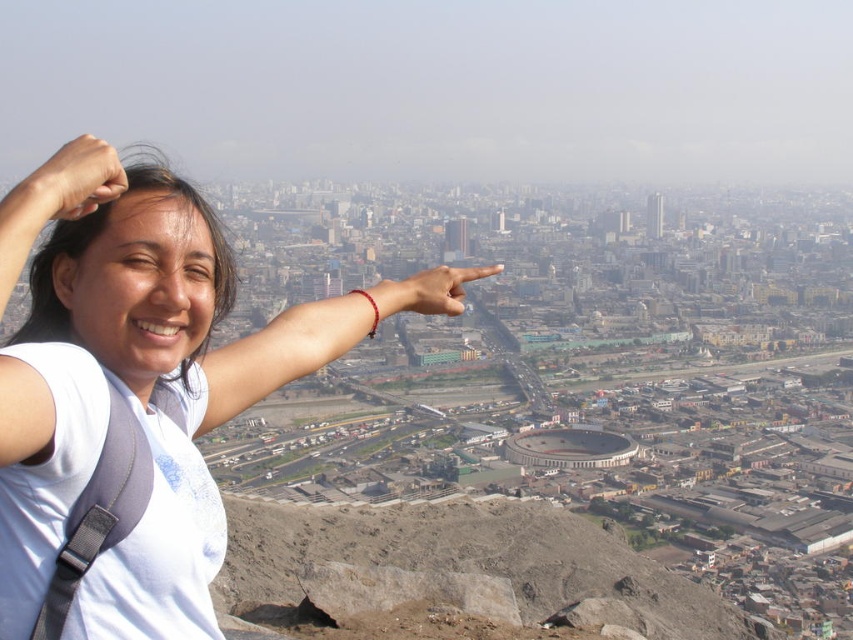
Question: Which point is closer to the camera?

Choices:
 (A) (49, 209)
 (B) (453, 301)
 (C) (163, 205)

Answer: (A)

Question: Can you confirm if matte skin hand at upper left is bigger than matte skin hand at center?

Choices:
 (A) no
 (B) yes

Answer: (B)

Question: Can you confirm if dull gray rock at center is smaller than matte skin hand at upper left?

Choices:
 (A) yes
 (B) no

Answer: (B)

Question: Which object appears farthest from the camera in this image?

Choices:
 (A) matte skin hand at center
 (B) dull gray rock at center
 (C) white matte shirt at upper left

Answer: (B)

Question: Which of the following is the closest to the observer?

Choices:
 (A) white matte shirt at upper left
 (B) matte skin hand at center
 (C) matte skin hand at upper left

Answer: (A)

Question: Is matte skin hand at upper left to the right of matte skin hand at center from the viewer's perspective?

Choices:
 (A) no
 (B) yes

Answer: (A)